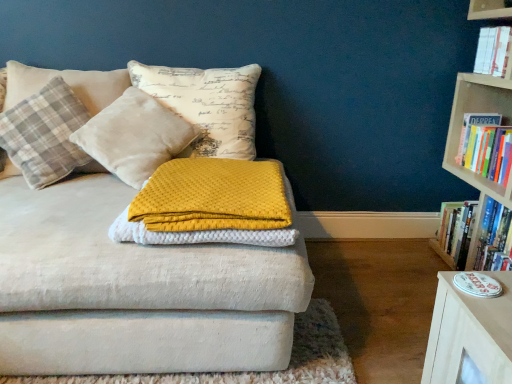
Question: Does yellow textured blanket at center appear on the left side of white paper book at upper right, the first book from the top?

Choices:
 (A) no
 (B) yes

Answer: (B)

Question: Can you confirm if yellow textured blanket at center is smaller than white paper book at upper right, the first book from the top?

Choices:
 (A) yes
 (B) no

Answer: (B)

Question: Is yellow textured blanket at center not close to white paper book at upper right, the third book positioned from the bottom?

Choices:
 (A) yes
 (B) no

Answer: (A)

Question: From a real-world perspective, is yellow textured blanket at center located higher than white paper book at upper right, the third book positioned from the bottom?

Choices:
 (A) no
 (B) yes

Answer: (A)

Question: Is yellow textured blanket at center surrounding white paper book at upper right, the third book positioned from the bottom?

Choices:
 (A) yes
 (B) no

Answer: (B)

Question: Can you confirm if yellow textured blanket at center is taller than white paper book at upper right, the first book from the top?

Choices:
 (A) no
 (B) yes

Answer: (A)

Question: Is there a large distance between hardcover book at right, placed as the third book when sorted from top to bottom, and plaid fabric pillow at left, which appears as the second pillow when viewed from the right?

Choices:
 (A) yes
 (B) no

Answer: (A)

Question: Can you confirm if hardcover book at right, placed as the third book when sorted from top to bottom, is thinner than plaid fabric pillow at left, which is the first pillow from left to right?

Choices:
 (A) no
 (B) yes

Answer: (B)

Question: Does hardcover book at right, which appears as the 1th book when ordered from the bottom, appear on the right side of plaid fabric pillow at left, which appears as the second pillow when viewed from the right?

Choices:
 (A) no
 (B) yes

Answer: (B)

Question: Is hardcover book at right, which appears as the 1th book when ordered from the bottom, outside plaid fabric pillow at left, which is the first pillow from left to right?

Choices:
 (A) yes
 (B) no

Answer: (A)

Question: From the image's perspective, is hardcover book at right, which appears as the 1th book when ordered from the bottom, on top of plaid fabric pillow at left, which is the first pillow from left to right?

Choices:
 (A) yes
 (B) no

Answer: (B)

Question: Does hardcover book at right, placed as the third book when sorted from top to bottom, come in front of plaid fabric pillow at left, which appears as the second pillow when viewed from the right?

Choices:
 (A) yes
 (B) no

Answer: (B)

Question: Can we say plaid fabric pillow at left, which is the first pillow from left to right, lies outside white paper book at upper right, the first book from the top?

Choices:
 (A) yes
 (B) no

Answer: (A)